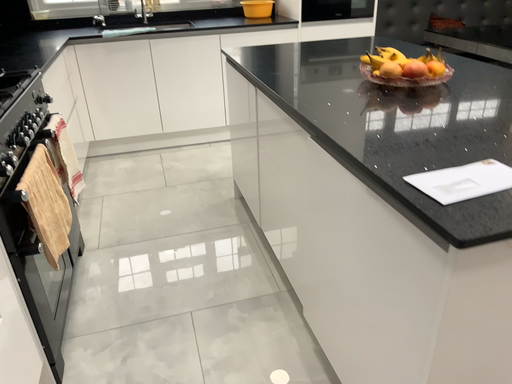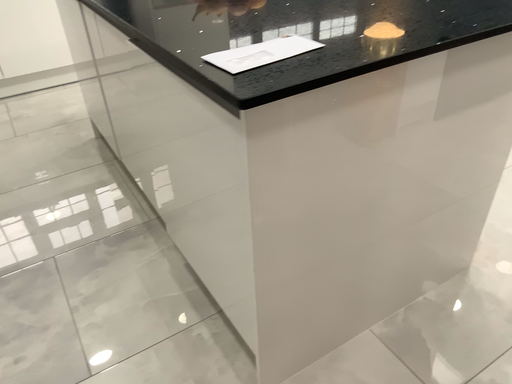
Question: How did the camera likely rotate when shooting the video?

Choices:
 (A) rotated left
 (B) rotated right

Answer: (B)